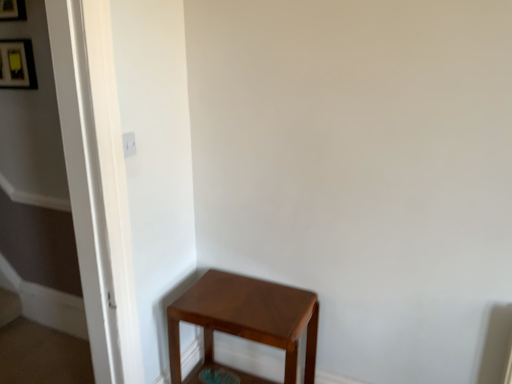
Question: Considering their positions, is matte black picture frame at upper left, marked as the first picture frame in a bottom-to-top arrangement, located in front of or behind matte brown stool at lower right?

Choices:
 (A) front
 (B) behind

Answer: (B)

Question: Is matte black picture frame at upper left, arranged as the 2th picture frame when viewed from the top, inside the boundaries of matte brown stool at lower right, or outside?

Choices:
 (A) outside
 (B) inside

Answer: (A)

Question: Estimate the real-world distances between objects in this image. Which object is closer to the matte black picture frame at upper left, the first picture frame positioned from the top?

Choices:
 (A) matte brown stool at lower right
 (B) matte black picture frame at upper left, marked as the first picture frame in a bottom-to-top arrangement

Answer: (B)

Question: Estimate the real-world distances between objects in this image. Which object is farther from the matte black picture frame at upper left, the first picture frame positioned from the top?

Choices:
 (A) matte brown stool at lower right
 (B) matte black picture frame at upper left, arranged as the 2th picture frame when viewed from the top

Answer: (A)